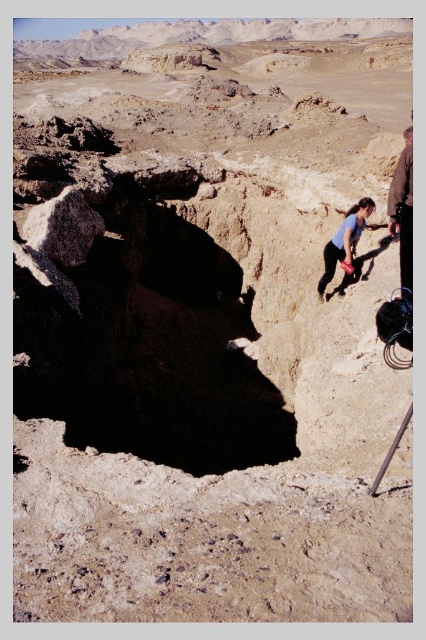
Question: In this image, where is dark gray rough rock at left located relative to blue fabric shirt at center?

Choices:
 (A) above
 (B) below

Answer: (A)

Question: Which point is closer to the camera?

Choices:
 (A) blue fabric shirt at center
 (B) brown leather jacket at right

Answer: (B)

Question: Based on their relative distances, which object is farther from the blue fabric shirt at center?

Choices:
 (A) brown leather jacket at right
 (B) dark gray rough rock at left

Answer: (B)

Question: Is brown leather jacket at right positioned before blue fabric shirt at center?

Choices:
 (A) no
 (B) yes

Answer: (B)

Question: Which of the following is the farthest from the observer?

Choices:
 (A) dark gray rough rock at left
 (B) blue fabric shirt at center
 (C) brown leather jacket at right

Answer: (B)

Question: Does dark gray rough rock at left come in front of brown leather jacket at right?

Choices:
 (A) yes
 (B) no

Answer: (B)